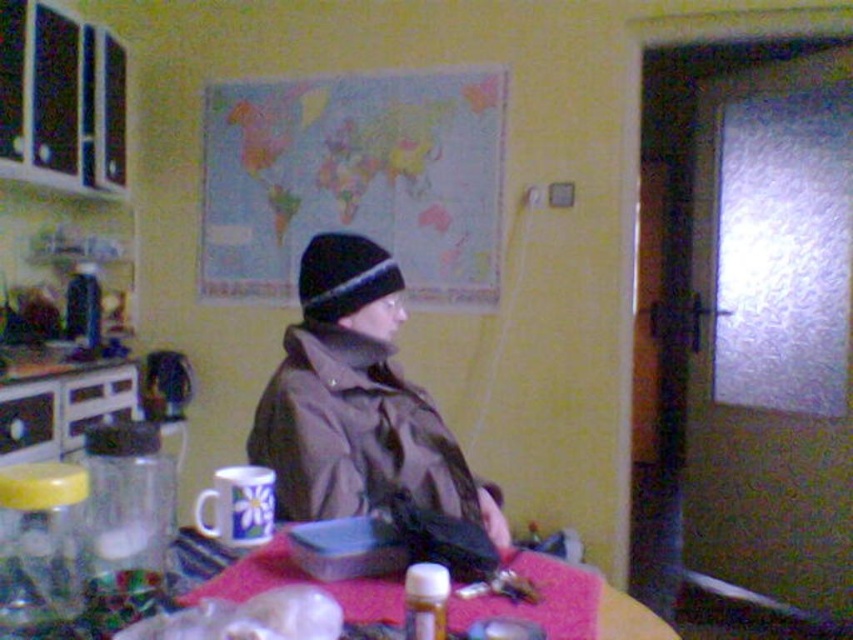
Can you confirm if brown matte jacket at center is wider than black knit hat at center?

Correct, the width of brown matte jacket at center exceeds that of black knit hat at center.

Does brown matte jacket at center have a larger size compared to black knit hat at center?

Yes.

The width and height of the screenshot is (853, 640). What are the coordinates of `brown matte jacket at center` in the screenshot? It's located at (357, 401).

The image size is (853, 640). What are the coordinates of `brown matte jacket at center` in the screenshot? It's located at (357, 401).